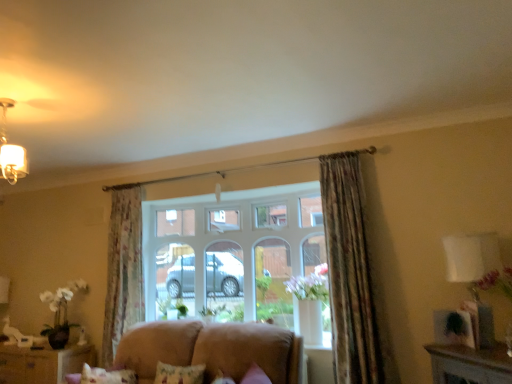
Question: Looking at their shapes, would you say suede-like beige sofa at lower center is wider or thinner than floral fabric curtain at upper right, placed as the second curtain when sorted from left to right?

Choices:
 (A) wide
 (B) thin

Answer: (A)

Question: Considering the positions of suede-like beige sofa at lower center and floral fabric curtain at upper right, placed as the second curtain when sorted from left to right, in the image, is suede-like beige sofa at lower center bigger or smaller than floral fabric curtain at upper right, placed as the second curtain when sorted from left to right,?

Choices:
 (A) small
 (B) big

Answer: (B)

Question: Which object is positioned farthest from the suede-like beige sofa at lower center?

Choices:
 (A) brown wooden cabinet at lower left
 (B) floral fabric curtain at left, the second curtain positioned from the right
 (C) floral fabric curtain at upper right, marked as the first curtain in a front-to-back arrangement
 (D) white fabric lampshade at right
 (E) fluffy pink pillow at lower center

Answer: (D)

Question: Which is nearer to the suede-like beige sofa at lower center?

Choices:
 (A) brown wooden cabinet at lower left
 (B) floral fabric curtain at upper right, marked as the first curtain in a front-to-back arrangement
 (C) fluffy pink pillow at lower center
 (D) floral fabric curtain at left, the 1th curtain from the back
 (E) white fabric lampshade at right

Answer: (C)